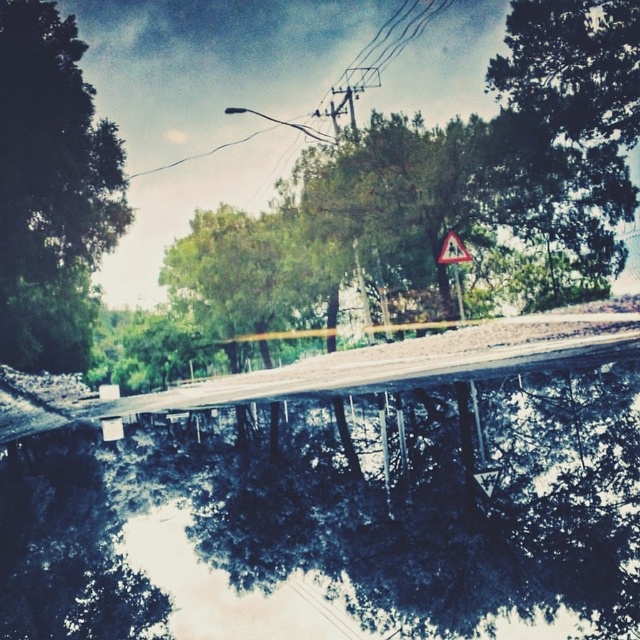
Question: Is the position of dark reflective water at center more distant than that of green leafy tree at upper right?

Choices:
 (A) yes
 (B) no

Answer: (B)

Question: Which object is farther from the camera taking this photo?

Choices:
 (A) metallic wire at upper center
 (B) green leafy tree at upper right

Answer: (A)

Question: Is green leafy tree at upper right smaller than metallic wire at upper center?

Choices:
 (A) yes
 (B) no

Answer: (A)

Question: Based on their relative distances, which object is nearer to the yellow reflective plastic pedestrian crossing sign at center?

Choices:
 (A) green leafy tree at upper right
 (B) green leafy tree at left

Answer: (A)

Question: Does dark reflective water at center lie in front of green leafy tree at left?

Choices:
 (A) no
 (B) yes

Answer: (B)

Question: Which object appears farthest from the camera in this image?

Choices:
 (A) green leafy tree at upper right
 (B) metallic wire at upper center
 (C) yellow reflective plastic triangular warning sign at upper center
 (D) green leafy tree at left

Answer: (B)